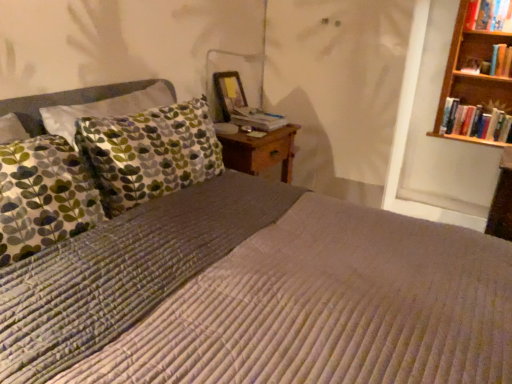
This screenshot has width=512, height=384. I want to click on blank space above hardcover books at right, the third book from the top (from a real-world perspective), so click(x=486, y=105).